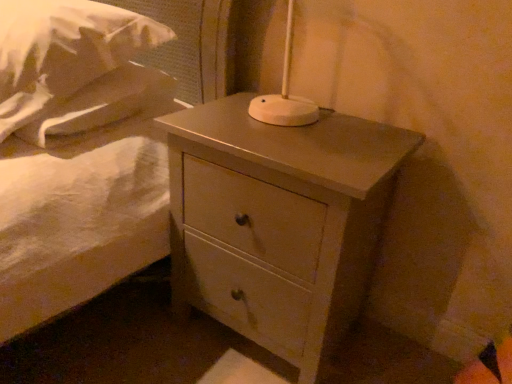
Question: From a real-world perspective, is white soft pillow at upper left under white matte nightstand at center?

Choices:
 (A) no
 (B) yes

Answer: (A)

Question: From the image's perspective, is white soft pillow at upper left above white matte nightstand at center?

Choices:
 (A) no
 (B) yes

Answer: (B)

Question: Considering the relative sizes of white soft pillow at upper left and white matte nightstand at center in the image provided, is white soft pillow at upper left thinner than white matte nightstand at center?

Choices:
 (A) yes
 (B) no

Answer: (B)

Question: Considering the relative sizes of white soft pillow at upper left and white matte nightstand at center in the image provided, is white soft pillow at upper left wider than white matte nightstand at center?

Choices:
 (A) yes
 (B) no

Answer: (A)

Question: Does white soft pillow at upper left appear on the left side of white matte nightstand at center?

Choices:
 (A) yes
 (B) no

Answer: (A)

Question: From a real-world perspective, is white soft pillow at upper left located higher than white matte nightstand at center?

Choices:
 (A) no
 (B) yes

Answer: (B)

Question: Can we say white matte nightstand at center lies outside white soft pillow at upper left?

Choices:
 (A) no
 (B) yes

Answer: (B)

Question: Is white matte nightstand at center far away from white soft pillow at upper left?

Choices:
 (A) yes
 (B) no

Answer: (B)

Question: Considering the relative sizes of white matte nightstand at center and white soft pillow at upper left in the image provided, is white matte nightstand at center shorter than white soft pillow at upper left?

Choices:
 (A) yes
 (B) no

Answer: (B)

Question: Does white matte nightstand at center come in front of white soft pillow at upper left?

Choices:
 (A) yes
 (B) no

Answer: (B)

Question: Considering the relative sizes of white matte nightstand at center and white soft pillow at upper left in the image provided, is white matte nightstand at center bigger than white soft pillow at upper left?

Choices:
 (A) yes
 (B) no

Answer: (A)

Question: Is white matte nightstand at center positioned with its back to white soft pillow at upper left?

Choices:
 (A) yes
 (B) no

Answer: (B)

Question: Is white matte nightstand at center inside or outside of white soft pillow at upper left?

Choices:
 (A) inside
 (B) outside

Answer: (B)